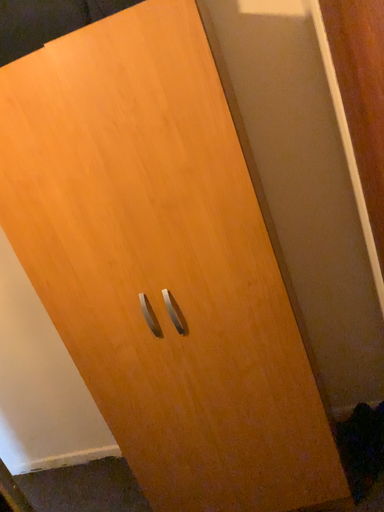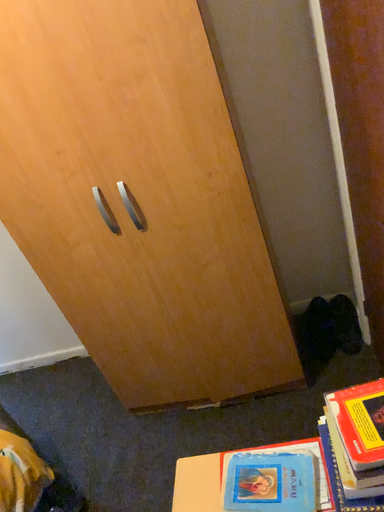
Question: How did the camera likely rotate when shooting the video?

Choices:
 (A) rotated downward
 (B) rotated upward

Answer: (A)